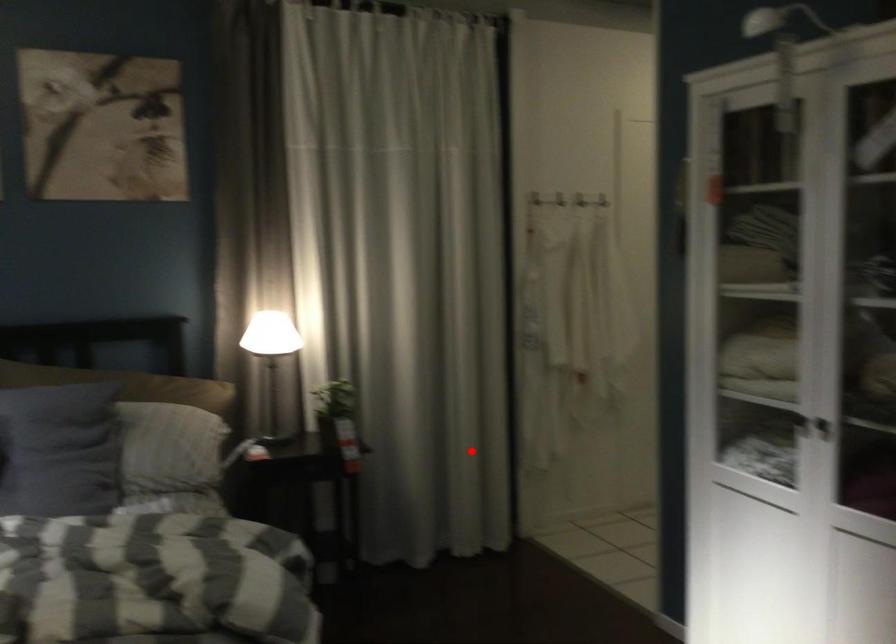
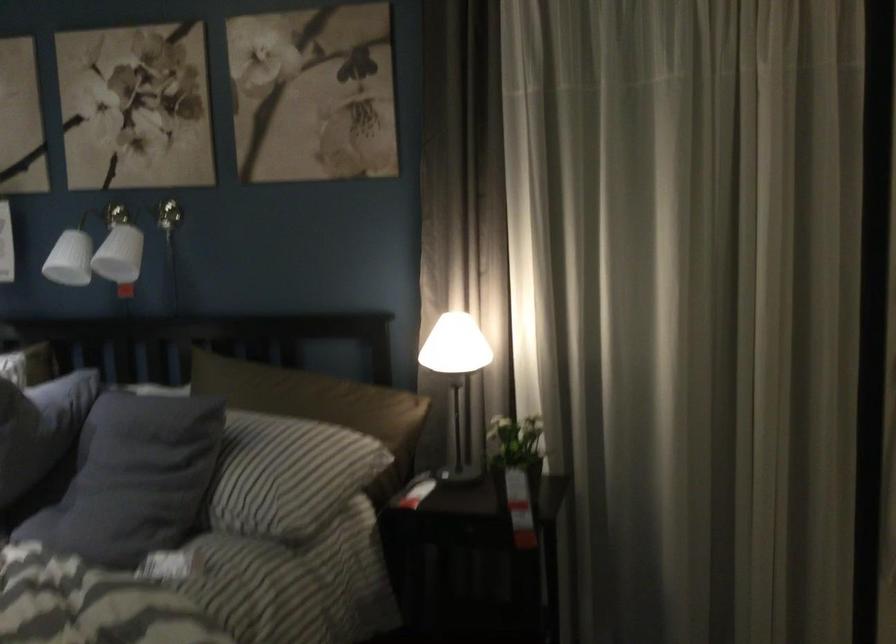
The point at the highlighted location is marked in the first image. Where is the corresponding point in the second image?

(761, 540)